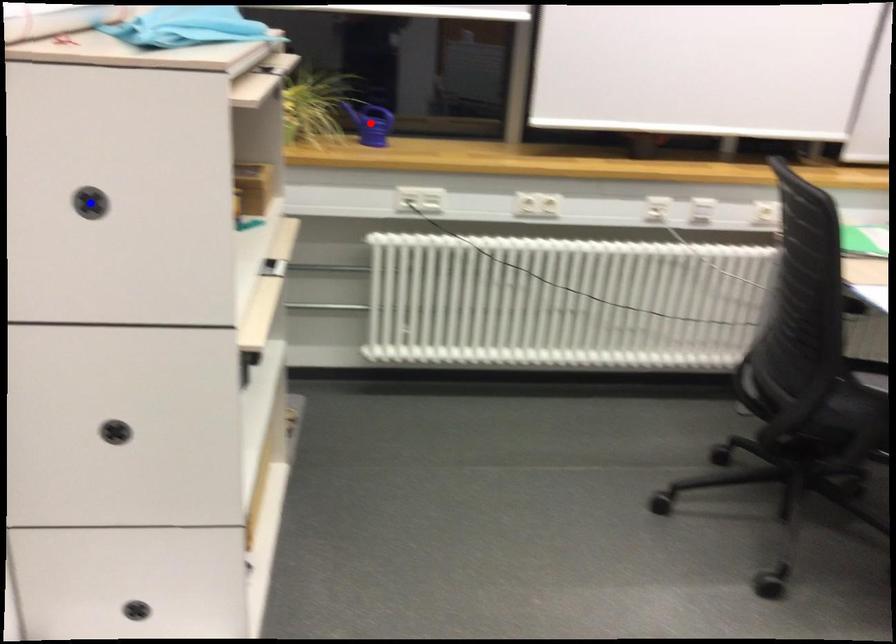
Question: Which of the two points in the image is closer to the camera?

Choices:
 (A) Blue point is closer.
 (B) Red point is closer.

Answer: (A)